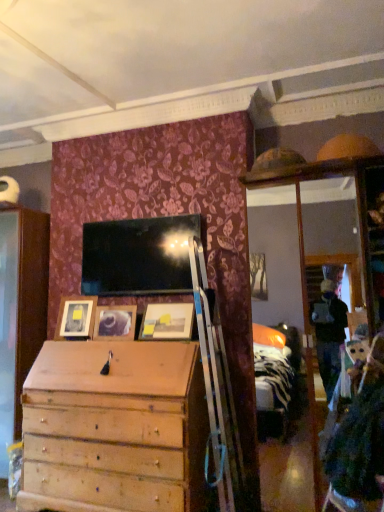
This screenshot has height=512, width=384. What do you see at coordinates (76, 318) in the screenshot?
I see `matte wooden picture frame at left, acting as the third picture frame starting from the right` at bounding box center [76, 318].

Find the location of `matte wooden picture frame at left, which is counted as the first picture frame, starting from the left`. matte wooden picture frame at left, which is counted as the first picture frame, starting from the left is located at coordinates (76, 318).

Measure the distance between matte wooden picture frame at center, which is the third picture frame in left-to-right order, and camera.

matte wooden picture frame at center, which is the third picture frame in left-to-right order, is 3.11 meters from camera.

Describe the element at coordinates (167, 321) in the screenshot. The height and width of the screenshot is (512, 384). I see `matte wooden picture frame at center, positioned as the first picture frame in right-to-left order` at that location.

Image resolution: width=384 pixels, height=512 pixels. Identify the location of wooden picture frame at center, the second picture frame from the left. (115, 322).

You are a GUI agent. You are given a task and a screenshot of the screen. Output one action in this format:
    pyautogui.click(x=<x>, y=<y>)
    Task: Click on the matte wooden picture frame at left, which is counted as the first picture frame, starting from the left
    The height and width of the screenshot is (512, 384).
    Given the screenshot: What is the action you would take?
    pyautogui.click(x=76, y=318)

Is wooden picture frame at center, the second picture frame from the left, smaller than matte wooden picture frame at left, which is counted as the first picture frame, starting from the left?

Yes, wooden picture frame at center, the second picture frame from the left, is smaller than matte wooden picture frame at left, which is counted as the first picture frame, starting from the left.

Is wooden picture frame at center, the second picture frame from the left, aimed at matte wooden picture frame at left, acting as the third picture frame starting from the right?

No, wooden picture frame at center, the second picture frame from the left, is not aimed at matte wooden picture frame at left, acting as the third picture frame starting from the right.

Considering the sizes of objects wooden picture frame at center, positioned as the 2th picture frame in right-to-left order, and matte wooden picture frame at left, acting as the third picture frame starting from the right, in the image provided, who is thinner, wooden picture frame at center, positioned as the 2th picture frame in right-to-left order, or matte wooden picture frame at left, acting as the third picture frame starting from the right,?

wooden picture frame at center, positioned as the 2th picture frame in right-to-left order.

Is wooden picture frame at center, the second picture frame from the left, at the right side of matte wooden picture frame at left, which is counted as the first picture frame, starting from the left?

Yes, wooden picture frame at center, the second picture frame from the left, is to the right of matte wooden picture frame at left, which is counted as the first picture frame, starting from the left.

What's the angular difference between matte wooden picture frame at left, which is counted as the first picture frame, starting from the left, and matte wooden picture frame at center, positioned as the first picture frame in right-to-left order,'s facing directions?

The facing directions of matte wooden picture frame at left, which is counted as the first picture frame, starting from the left, and matte wooden picture frame at center, positioned as the first picture frame in right-to-left order, are 5.94 degrees apart.

Which is correct: matte wooden picture frame at left, which is counted as the first picture frame, starting from the left, is inside matte wooden picture frame at center, positioned as the first picture frame in right-to-left order, or outside of it?

matte wooden picture frame at left, which is counted as the first picture frame, starting from the left, is located beyond the bounds of matte wooden picture frame at center, positioned as the first picture frame in right-to-left order.

Which of these two, matte wooden picture frame at left, which is counted as the first picture frame, starting from the left, or matte wooden picture frame at center, which is the third picture frame in left-to-right order, is wider?

Wider between the two is matte wooden picture frame at center, which is the third picture frame in left-to-right order.

Is matte wooden picture frame at left, acting as the third picture frame starting from the right, to the right of matte wooden picture frame at center, positioned as the first picture frame in right-to-left order, from the viewer's perspective?

Incorrect, matte wooden picture frame at left, acting as the third picture frame starting from the right, is not on the right side of matte wooden picture frame at center, positioned as the first picture frame in right-to-left order.

Based on their positions, is matte wooden picture frame at left, acting as the third picture frame starting from the right, located to the left or right of wooden picture frame at center, the second picture frame from the left?

Based on their positions, matte wooden picture frame at left, acting as the third picture frame starting from the right, is located to the left of wooden picture frame at center, the second picture frame from the left.

Consider the image. Is matte wooden picture frame at left, acting as the third picture frame starting from the right, positioned with its back to wooden picture frame at center, the second picture frame from the left?

matte wooden picture frame at left, acting as the third picture frame starting from the right, does not have its back to wooden picture frame at center, the second picture frame from the left.

Consider the image. Is matte wooden picture frame at left, which is counted as the first picture frame, starting from the left, in front of or behind wooden picture frame at center, positioned as the 2th picture frame in right-to-left order, in the image?

Clearly, matte wooden picture frame at left, which is counted as the first picture frame, starting from the left, is behind wooden picture frame at center, positioned as the 2th picture frame in right-to-left order.

From the image's perspective, relative to matte wooden picture frame at left, which is counted as the first picture frame, starting from the left, is matte wooden picture frame at center, positioned as the first picture frame in right-to-left order, above or below?

Based on their image positions, matte wooden picture frame at center, positioned as the first picture frame in right-to-left order, is located above matte wooden picture frame at left, which is counted as the first picture frame, starting from the left.

Is matte wooden picture frame at center, positioned as the first picture frame in right-to-left order, not inside matte wooden picture frame at left, which is counted as the first picture frame, starting from the left?

Yes.

Can you tell me how much matte wooden picture frame at center, which is the third picture frame in left-to-right order, and matte wooden picture frame at left, acting as the third picture frame starting from the right, differ in facing direction?

The angle between the facing direction of matte wooden picture frame at center, which is the third picture frame in left-to-right order, and the facing direction of matte wooden picture frame at left, acting as the third picture frame starting from the right, is 5.94 degrees.

Which of these two, matte wooden picture frame at center, which is the third picture frame in left-to-right order, or matte wooden picture frame at left, which is counted as the first picture frame, starting from the left, is wider?

With larger width is matte wooden picture frame at center, which is the third picture frame in left-to-right order.

Considering the sizes of objects wooden picture frame at center, positioned as the 2th picture frame in right-to-left order, and matte wooden picture frame at center, positioned as the first picture frame in right-to-left order, in the image provided, who is shorter, wooden picture frame at center, positioned as the 2th picture frame in right-to-left order, or matte wooden picture frame at center, positioned as the first picture frame in right-to-left order,?

wooden picture frame at center, positioned as the 2th picture frame in right-to-left order.

From a real-world perspective, is wooden picture frame at center, positioned as the 2th picture frame in right-to-left order, on matte wooden picture frame at center, positioned as the first picture frame in right-to-left order?

No.

Which is behind, point (120, 308) or point (173, 332)?

The point (120, 308) is behind.

From a real-world perspective, which picture frame is the 1st one above the wooden picture frame at center, positioned as the 2th picture frame in right-to-left order? Please provide its 2D coordinates.

[(167, 321)]

Between point (178, 323) and point (105, 319), which one is positioned behind?

The point (105, 319) is farther from the camera.

Can wooden picture frame at center, positioned as the 2th picture frame in right-to-left order, be found inside matte wooden picture frame at center, positioned as the first picture frame in right-to-left order?

No, matte wooden picture frame at center, positioned as the first picture frame in right-to-left order, does not contain wooden picture frame at center, positioned as the 2th picture frame in right-to-left order.

From the image's perspective, between matte wooden picture frame at center, which is the third picture frame in left-to-right order, and wooden picture frame at center, positioned as the 2th picture frame in right-to-left order, which one is located above?

From the image's view, matte wooden picture frame at center, which is the third picture frame in left-to-right order, is above.

Would you say matte wooden picture frame at center, positioned as the first picture frame in right-to-left order, is to the left or to the right of wooden picture frame at center, the second picture frame from the left, in the picture?

In the image, matte wooden picture frame at center, positioned as the first picture frame in right-to-left order, appears on the right side of wooden picture frame at center, the second picture frame from the left.

Locate an element on the screen. The width and height of the screenshot is (384, 512). picture frame below the matte wooden picture frame at left, which is counted as the first picture frame, starting from the left (from the image's perspective) is located at coordinates (115, 322).

Locate an element on the screen. The height and width of the screenshot is (512, 384). picture frame above the matte wooden picture frame at left, which is counted as the first picture frame, starting from the left (from the image's perspective) is located at coordinates (167, 321).

From the picture: Which object lies further to the anchor point wooden picture frame at center, the second picture frame from the left, matte wooden picture frame at center, positioned as the first picture frame in right-to-left order, or matte wooden picture frame at left, acting as the third picture frame starting from the right?

Based on the image, matte wooden picture frame at center, positioned as the first picture frame in right-to-left order, appears to be further to wooden picture frame at center, the second picture frame from the left.

Looking at the image, which one is located closer to matte wooden picture frame at center, which is the third picture frame in left-to-right order, wooden picture frame at center, positioned as the 2th picture frame in right-to-left order, or matte wooden picture frame at left, acting as the third picture frame starting from the right?

The object closer to matte wooden picture frame at center, which is the third picture frame in left-to-right order, is wooden picture frame at center, positioned as the 2th picture frame in right-to-left order.

Looking at the image, which one is located closer to matte wooden picture frame at left, acting as the third picture frame starting from the right, matte wooden picture frame at center, which is the third picture frame in left-to-right order, or wooden picture frame at center, the second picture frame from the left?

Based on the image, wooden picture frame at center, the second picture frame from the left, appears to be nearer to matte wooden picture frame at left, acting as the third picture frame starting from the right.

From the picture: Considering their positions, is matte wooden picture frame at left, which is counted as the first picture frame, starting from the left, positioned further to matte wooden picture frame at center, which is the third picture frame in left-to-right order, than wooden picture frame at center, the second picture frame from the left?

matte wooden picture frame at left, which is counted as the first picture frame, starting from the left.

Estimate the real-world distances between objects in this image. Which object is closer to matte wooden picture frame at left, which is counted as the first picture frame, starting from the left, wooden picture frame at center, positioned as the 2th picture frame in right-to-left order, or matte wooden picture frame at center, which is the third picture frame in left-to-right order?

Among the two, wooden picture frame at center, positioned as the 2th picture frame in right-to-left order, is located nearer to matte wooden picture frame at left, which is counted as the first picture frame, starting from the left.

Considering their positions, is matte wooden picture frame at left, acting as the third picture frame starting from the right, positioned closer to wooden picture frame at center, positioned as the 2th picture frame in right-to-left order, than matte wooden picture frame at center, positioned as the first picture frame in right-to-left order?

matte wooden picture frame at left, acting as the third picture frame starting from the right.

At what (x,y) coordinates should I click in order to perform the action: click on picture frame situated between matte wooden picture frame at left, acting as the third picture frame starting from the right, and matte wooden picture frame at center, positioned as the first picture frame in right-to-left order, from left to right. Please return your answer as a coordinate pair (x, y). Looking at the image, I should click on (115, 322).